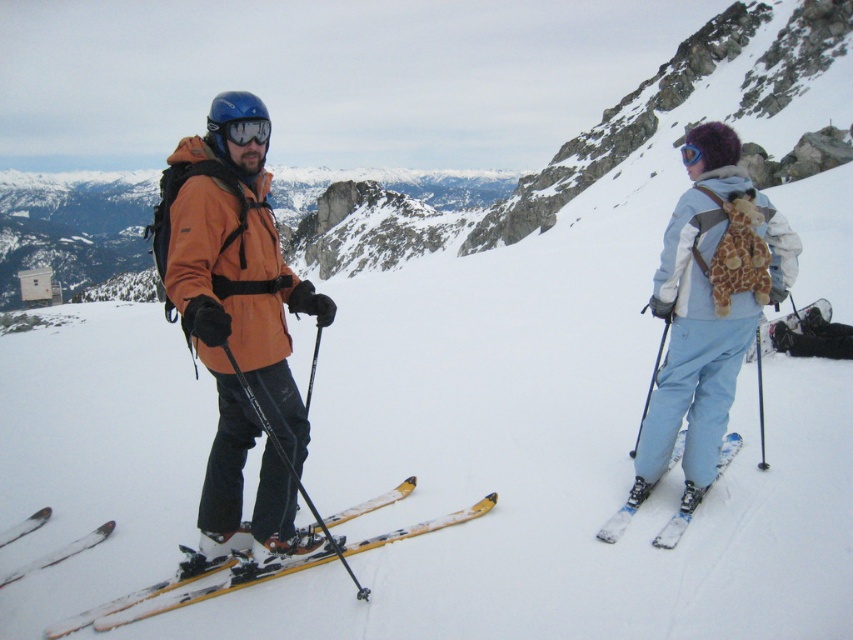
You are planning to take a photo of the matte orange jacket at center and the yellow metallic skis at lower left. Which object should you focus on first if you want to capture both in the frame without moving the camera?

The matte orange jacket at center is larger in size than the yellow metallic skis at lower left, so you should focus on the matte orange jacket at center first to ensure it fits properly in the frame before adjusting for the smaller object.

You are a ski instructor observing two skiers on the slope. You notice the matte orange jacket at center and the yellow metallic skis at lower left. Which object is positioned more to the left?

The yellow metallic skis at lower left are positioned more to the left than the matte orange jacket at center.

You are a photographer trying to capture a clear shot of the matte orange jacket at center and the yellow metallic skis at lower left. Can you see both objects fully without any obstruction?

The matte orange jacket at center is positioned over the yellow metallic skis at lower left, so the jacket may obstruct part of the skis in your shot.